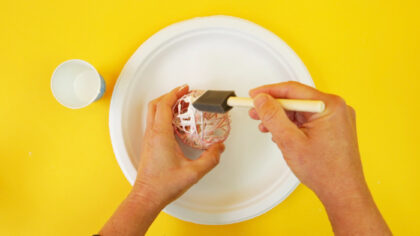
What are the coordinates of `plate` in the screenshot? It's located at (236, 68).